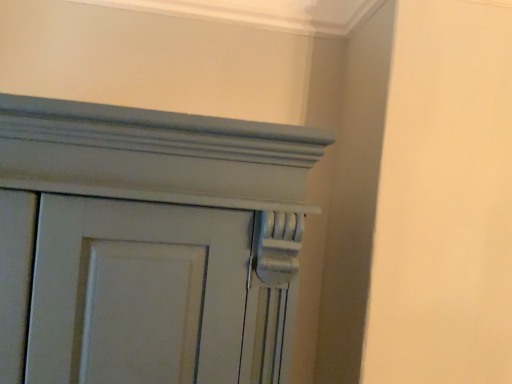
The height and width of the screenshot is (384, 512). What do you see at coordinates (147, 244) in the screenshot?
I see `matte gray door at center` at bounding box center [147, 244].

The height and width of the screenshot is (384, 512). I want to click on matte gray door at center, so click(147, 244).

What is the approximate height of matte gray door at center?

matte gray door at center is 29.10 inches tall.

At what (x,y) coordinates should I click in order to perform the action: click on matte gray door at center. Please return your answer as a coordinate pair (x, y). This screenshot has height=384, width=512. Looking at the image, I should click on (147, 244).